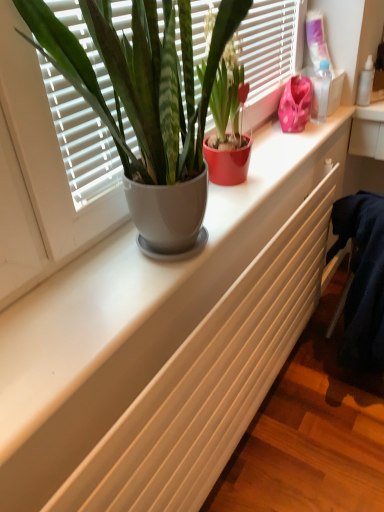
Question: From the image's perspective, is transparent plastic bottle at upper right, the 2th toiletry when ordered from right to left, located above or below white matte radiator at center?

Choices:
 (A) below
 (B) above

Answer: (B)

Question: In terms of width, does transparent plastic bottle at upper right, which is the 1th toiletry from front to back, look wider or thinner when compared to white matte radiator at center?

Choices:
 (A) wide
 (B) thin

Answer: (B)

Question: Which of these objects is positioned farthest from the clear plastic spray bottle at upper right, which appears as the 2th toiletry when viewed from the front?

Choices:
 (A) pink fabric at upper right
 (B) transparent plastic bottle at upper right, the first toiletry in the left-to-right sequence
 (C) white matte radiator at center
 (D) matte white pot at upper left, which appears as the second houseplant when viewed from the right
 (E) matte ceramic pot at center, the second houseplant when ordered from left to right

Answer: (D)

Question: Considering the real-world distances, which object is farthest from the matte white pot at upper left, arranged as the 1th houseplant when viewed from the left?

Choices:
 (A) matte ceramic pot at center, the second houseplant when ordered from left to right
 (B) transparent plastic bottle at upper right, the first toiletry in the left-to-right sequence
 (C) pink fabric at upper right
 (D) clear plastic spray bottle at upper right, placed as the 2th toiletry when sorted from left to right
 (E) white matte radiator at center

Answer: (D)